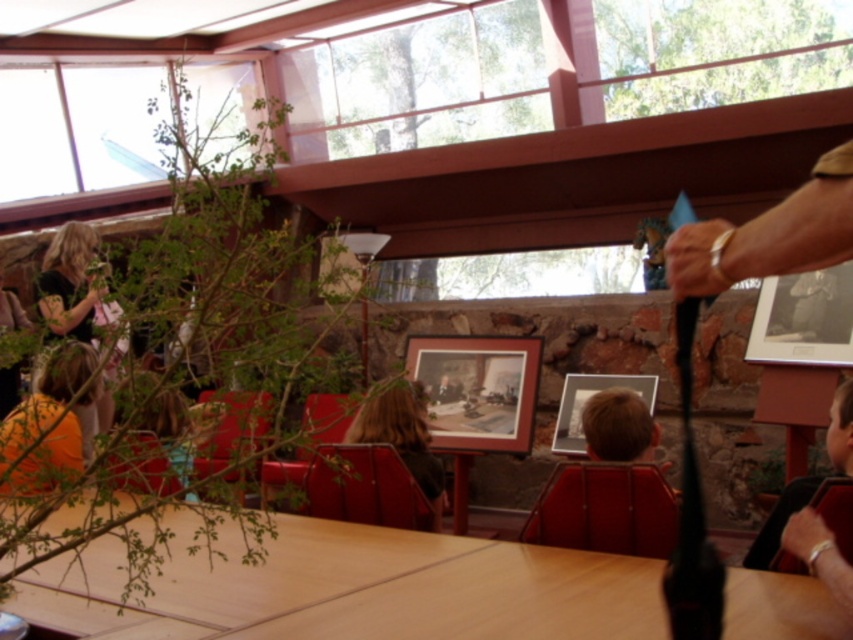
You are planning to hang a new picture on the wall between the wooden framed picture at center and the light brown hair at lower right. Based on their widths, which object should you consider first to ensure enough space?

The wooden framed picture at center might be wider than the light brown hair at lower right, so you should consider its width first to ensure there is enough space for the new picture.

You are an interior designer assessing the space. You need to ensure that the wooden framed picture at center and the light brown hair at lower right are proportionally balanced. Considering their sizes, which object should be placed in a more prominent position to achieve this balance?

The wooden framed picture at center is bigger than the light brown hair at lower right, so to achieve proportional balance, the smaller object, light brown hair at lower right, should be placed in a more prominent position to compensate for its smaller size.